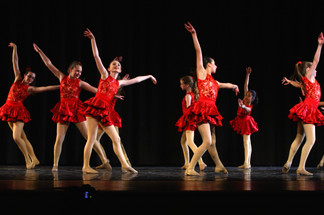
At what (x,y) coordinates should I click in order to perform the action: click on 1 phone. Please return your answer as a coordinate pair (x, y). This screenshot has height=215, width=324. Looking at the image, I should click on (82, 198).